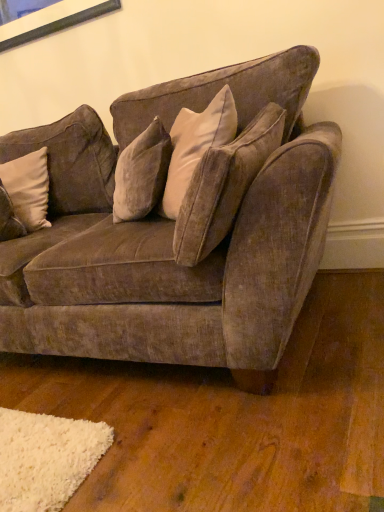
The height and width of the screenshot is (512, 384). Describe the element at coordinates (28, 188) in the screenshot. I see `beige velvet pillow at left` at that location.

You are a GUI agent. You are given a task and a screenshot of the screen. Output one action in this format:
    pyautogui.click(x=<x>, y=<y>)
    Task: Click on the beige velvet pillow at left
    
    Given the screenshot: What is the action you would take?
    pyautogui.click(x=28, y=188)

What is the approximate width of beige velvet pillow at left?

It is 10.00 inches.

The image size is (384, 512). What do you see at coordinates (178, 232) in the screenshot?
I see `velvet brown couch at center` at bounding box center [178, 232].

Image resolution: width=384 pixels, height=512 pixels. Find the location of `velvet brown couch at center`. velvet brown couch at center is located at coordinates (178, 232).

Measure the distance between velvet brown couch at center and camera.

A distance of 36.71 inches exists between velvet brown couch at center and camera.

Image resolution: width=384 pixels, height=512 pixels. Find the location of `beige velvet pillow at left`. beige velvet pillow at left is located at coordinates (28, 188).

Is beige velvet pillow at left at the right side of velvet brown couch at center?

No, beige velvet pillow at left is not to the right of velvet brown couch at center.

Is beige velvet pillow at left further to the viewer compared to velvet brown couch at center?

Yes, beige velvet pillow at left is behind velvet brown couch at center.

Is point (18, 196) positioned behind point (255, 132)?

Yes.

From the image's perspective, between beige velvet pillow at left and velvet brown couch at center, who is located below?

velvet brown couch at center, from the image's perspective.

From a real-world perspective, which is physically above, beige velvet pillow at left or velvet brown couch at center?

In real-world perspective, beige velvet pillow at left is above.

Is beige velvet pillow at left wider than velvet brown couch at center?

No, beige velvet pillow at left is not wider than velvet brown couch at center.

From their relative heights in the image, would you say beige velvet pillow at left is taller or shorter than velvet brown couch at center?

Clearly, beige velvet pillow at left is shorter compared to velvet brown couch at center.

Between beige velvet pillow at left and velvet brown couch at center, which one has smaller size?

Smaller between the two is beige velvet pillow at left.

Do you think beige velvet pillow at left is within velvet brown couch at center, or outside of it?

beige velvet pillow at left is enclosed within velvet brown couch at center.

Is beige velvet pillow at left not near velvet brown couch at center?

No, beige velvet pillow at left is not far away from velvet brown couch at center.

Is beige velvet pillow at left positioned with its back to velvet brown couch at center?

Yes, beige velvet pillow at left is positioned with its back facing velvet brown couch at center.

Can you tell me how much beige velvet pillow at left and velvet brown couch at center differ in facing direction?

18.9 degrees.

This screenshot has width=384, height=512. I want to click on pillow above the velvet brown couch at center (from the image's perspective), so click(x=28, y=188).

Between velvet brown couch at center and beige velvet pillow at left, which one appears on the left side from the viewer's perspective?

beige velvet pillow at left.

Is velvet brown couch at center further to the viewer compared to beige velvet pillow at left?

No, velvet brown couch at center is closer to the viewer.

Considering the positions of point (15, 324) and point (42, 152), is point (15, 324) closer or farther from the camera than point (42, 152)?

Point (15, 324) is closer to the camera than point (42, 152).

From the image's perspective, is velvet brown couch at center located above beige velvet pillow at left?

No, from the image's perspective, velvet brown couch at center is not on top of beige velvet pillow at left.

From a real-world perspective, does velvet brown couch at center stand above beige velvet pillow at left?

Actually, velvet brown couch at center is physically below beige velvet pillow at left in the real world.

In the scene shown: Looking at their sizes, would you say velvet brown couch at center is wider or thinner than beige velvet pillow at left?

In the image, velvet brown couch at center appears to be wider than beige velvet pillow at left.

Between velvet brown couch at center and beige velvet pillow at left, which one has more height?

velvet brown couch at center is taller.

Considering the relative sizes of velvet brown couch at center and beige velvet pillow at left in the image provided, is velvet brown couch at center smaller than beige velvet pillow at left?

Incorrect, velvet brown couch at center is not smaller in size than beige velvet pillow at left.

From the picture: Is velvet brown couch at center inside or outside of beige velvet pillow at left?

The correct answer is: outside.

In the scene shown: Does velvet brown couch at center touch beige velvet pillow at left?

No, velvet brown couch at center is not making contact with beige velvet pillow at left.

Does velvet brown couch at center turn towards beige velvet pillow at left?

Yes.

Can you tell me how much velvet brown couch at center and beige velvet pillow at left differ in facing direction?

18.9 degrees.

Measure the distance from velvet brown couch at center to beige velvet pillow at left.

The distance of velvet brown couch at center from beige velvet pillow at left is 21.13 inches.

At what (x,y) coordinates should I click in order to perform the action: click on studio couch on the right of the beige velvet pillow at left. Please return your answer as a coordinate pair (x, y). Looking at the image, I should click on (178, 232).

This screenshot has width=384, height=512. I want to click on pillow positioned vertically above the velvet brown couch at center (from a real-world perspective), so click(x=28, y=188).

The image size is (384, 512). Find the location of `studio couch below the beige velvet pillow at left (from the image's perspective)`. studio couch below the beige velvet pillow at left (from the image's perspective) is located at coordinates (178, 232).